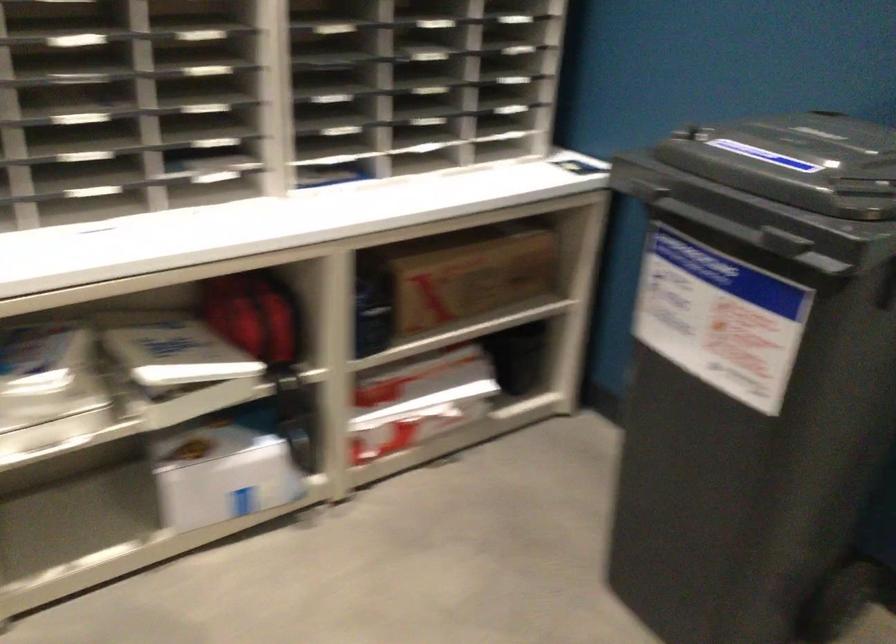
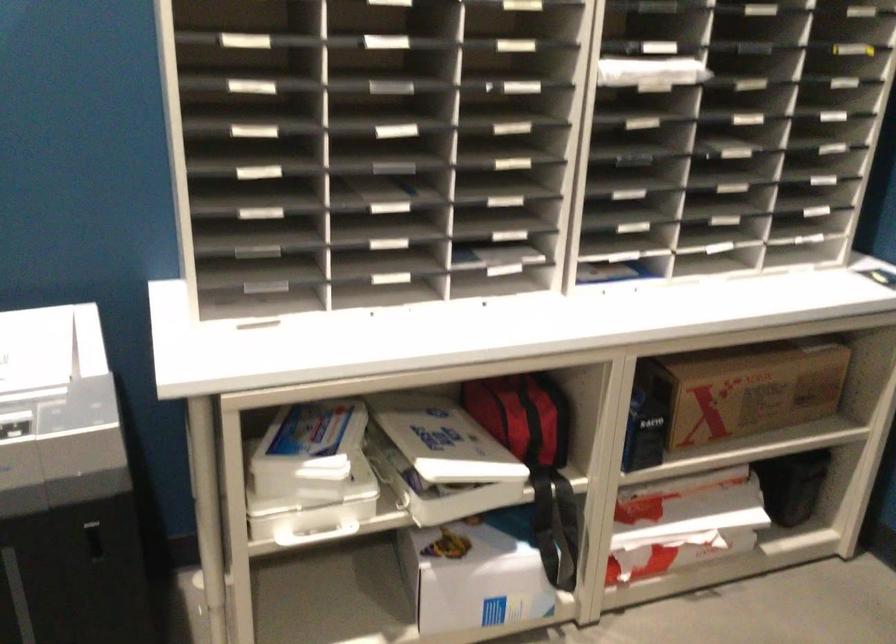
In a continuous first-person perspective shot, in which direction is the camera moving?

The cameraman walked toward left, forward.